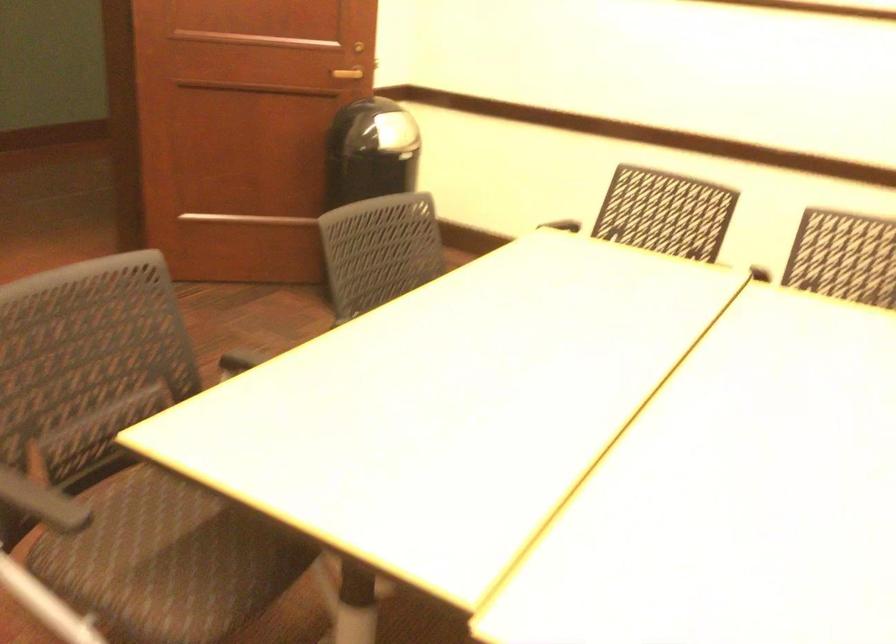
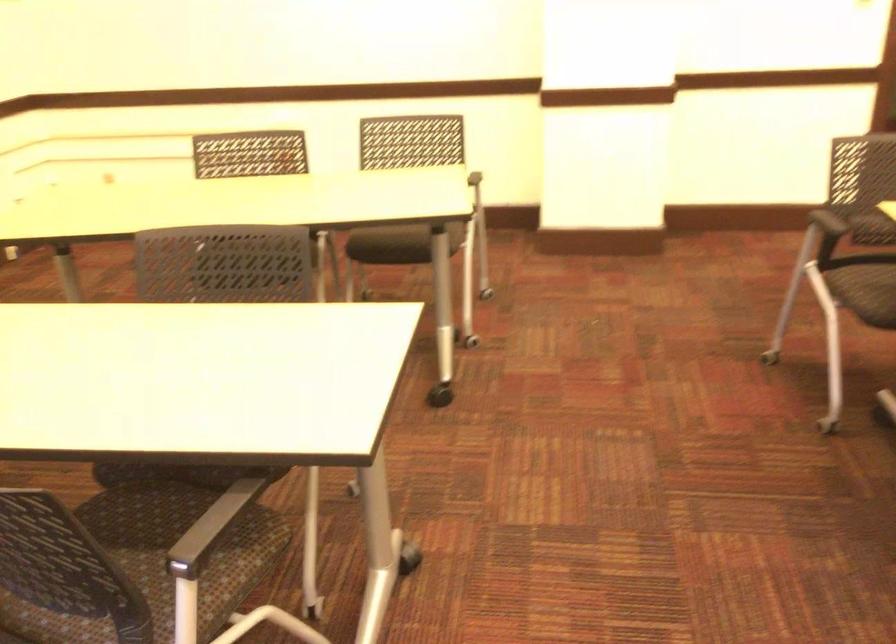
In the second image, find the point that corresponds to (x=179, y=542) in the first image.

(872, 283)